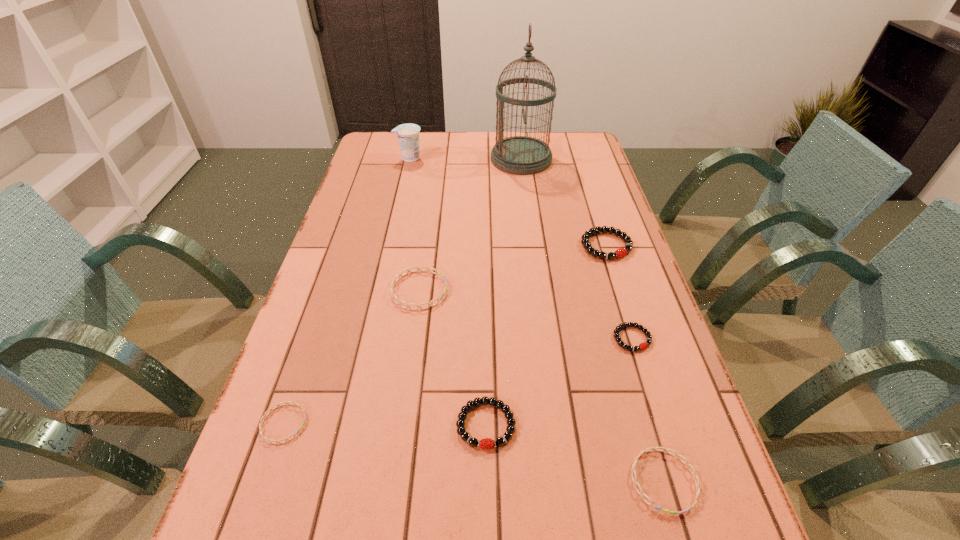
The image size is (960, 540). Identify the location of the rightmost blue bracelet. (666, 450).

Where is `the second nearest black bracelet`? Image resolution: width=960 pixels, height=540 pixels. the second nearest black bracelet is located at coordinates (642, 346).

Find the location of a particular element. the smallest black bracelet is located at coordinates (642, 346).

Identify the location of the second farthest blue bracelet. Image resolution: width=960 pixels, height=540 pixels. (289, 402).

At what (x,y) coordinates should I click in order to perform the action: click on the leftmost blue bracelet. Please return your answer as a coordinate pair (x, y). The image size is (960, 540). Looking at the image, I should click on (289, 402).

This screenshot has width=960, height=540. What are the coordinates of `blank area located on the front-facing side of the tallest object` in the screenshot? It's located at [416, 159].

Where is `vacant area located on the front-facing side of the tallest object`? This screenshot has height=540, width=960. vacant area located on the front-facing side of the tallest object is located at coordinates (432, 159).

At what (x,y) coordinates should I click in order to perform the action: click on vacant space situated 0.220m on the front-facing side of the tallest object. Please return your answer as a coordinate pair (x, y). This screenshot has height=540, width=960. Looking at the image, I should click on (432, 159).

Where is `vacant point located on the front of the seventh shortest object`? Image resolution: width=960 pixels, height=540 pixels. vacant point located on the front of the seventh shortest object is located at coordinates (403, 183).

Find the location of `vacant space located on the left of the farthest black bracelet`. vacant space located on the left of the farthest black bracelet is located at coordinates (506, 246).